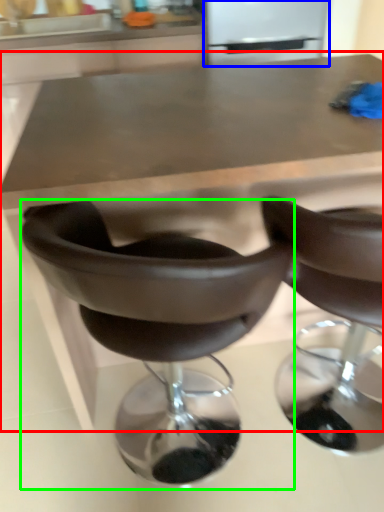
Question: Which object is the farthest from table (highlighted by a red box)? Choose among these: appliance (highlighted by a blue box) or chair (highlighted by a green box).

Choices:
 (A) appliance
 (B) chair

Answer: (A)